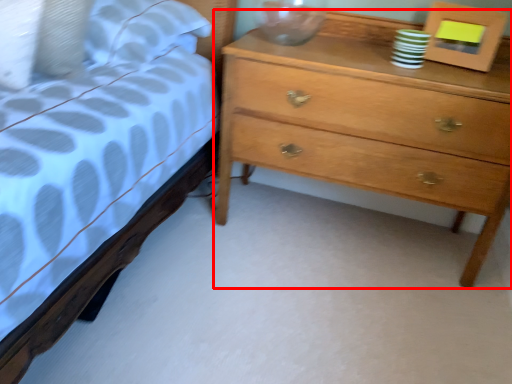
Question: From the image's perspective, where is chest of drawers (annotated by the red box) located in relation to picture frame in the image?

Choices:
 (A) above
 (B) below

Answer: (B)